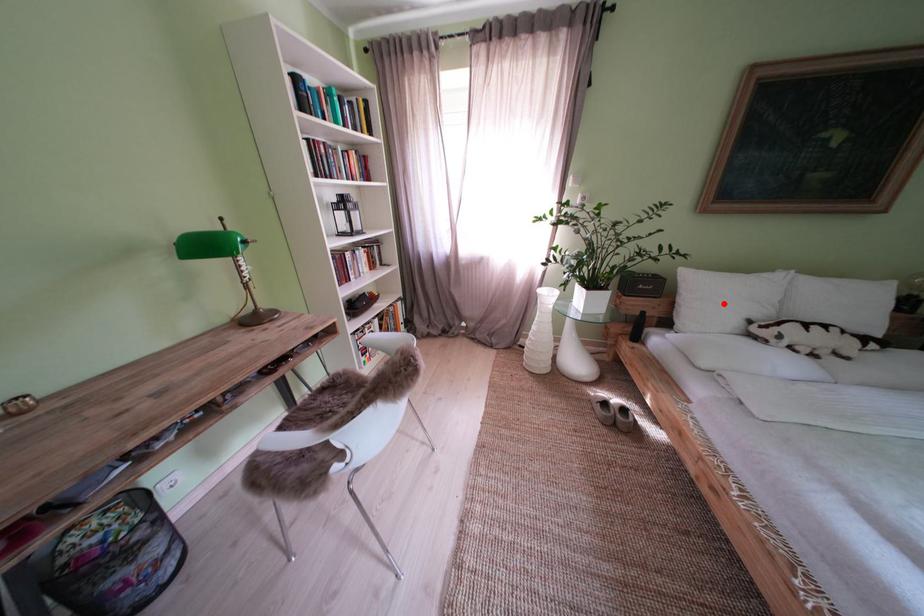
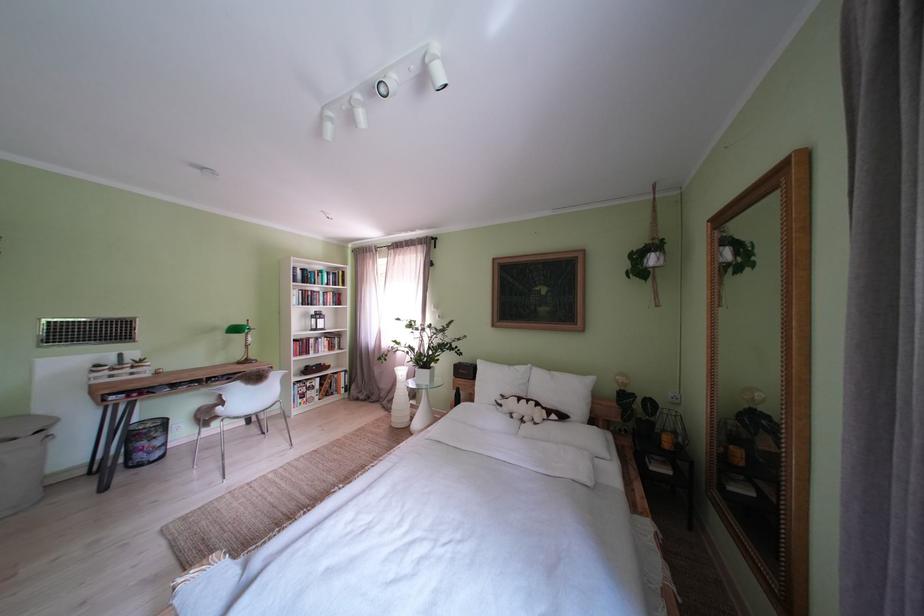
Find the pixel in the second image that matches the highlighted location in the first image.

(500, 386)